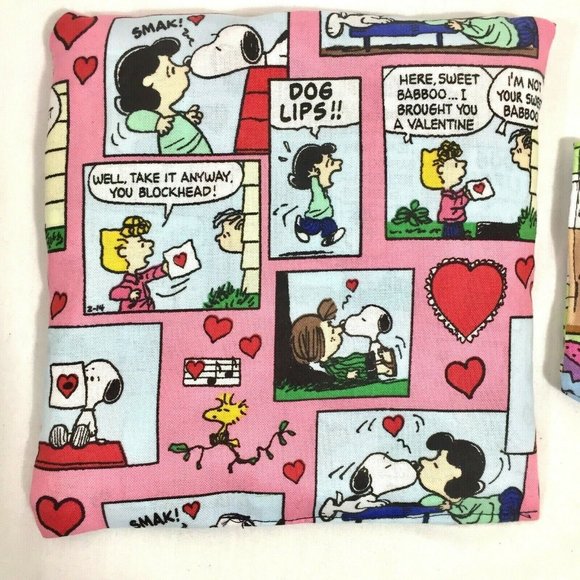
At what (x,y) coordinates should I click in order to perform the action: click on pink fabric. Please return your answer as a coordinate pair (x, y). The width and height of the screenshot is (580, 580). Looking at the image, I should click on (157, 482), (496, 366), (373, 152), (87, 105).